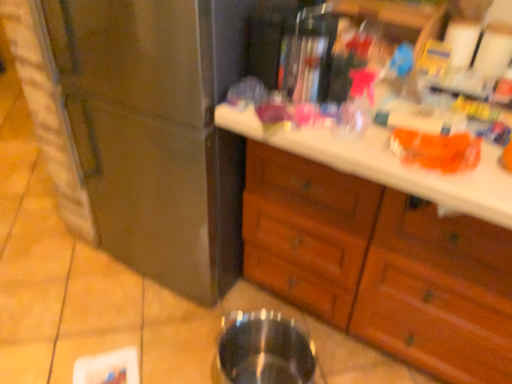
Question: Does transparent glass at lower center have a greater height compared to wooden drawers at center?

Choices:
 (A) no
 (B) yes

Answer: (A)

Question: Is transparent glass at lower center positioned before wooden drawers at center?

Choices:
 (A) yes
 (B) no

Answer: (B)

Question: Considering the relative positions of transparent glass at lower center and wooden drawers at center in the image provided, is transparent glass at lower center to the left of wooden drawers at center from the viewer's perspective?

Choices:
 (A) no
 (B) yes

Answer: (B)

Question: Is transparent glass at lower center oriented away from wooden drawers at center?

Choices:
 (A) no
 (B) yes

Answer: (B)

Question: Is transparent glass at lower center aimed at wooden drawers at center?

Choices:
 (A) yes
 (B) no

Answer: (B)

Question: From the image's perspective, is transparent glass at lower center below wooden drawers at center?

Choices:
 (A) yes
 (B) no

Answer: (A)

Question: Considering the relative positions of stainless steel refrigerator at left and wooden drawers at center in the image provided, is stainless steel refrigerator at left to the left of wooden drawers at center from the viewer's perspective?

Choices:
 (A) no
 (B) yes

Answer: (B)

Question: Can you confirm if stainless steel refrigerator at left is positioned to the right of wooden drawers at center?

Choices:
 (A) yes
 (B) no

Answer: (B)

Question: Is stainless steel refrigerator at left further to camera compared to wooden drawers at center?

Choices:
 (A) no
 (B) yes

Answer: (B)

Question: Considering the relative sizes of stainless steel refrigerator at left and wooden drawers at center in the image provided, is stainless steel refrigerator at left smaller than wooden drawers at center?

Choices:
 (A) no
 (B) yes

Answer: (B)

Question: Could you tell me if stainless steel refrigerator at left is turned towards wooden drawers at center?

Choices:
 (A) no
 (B) yes

Answer: (A)

Question: Is stainless steel refrigerator at left positioned far away from wooden drawers at center?

Choices:
 (A) yes
 (B) no

Answer: (B)

Question: Is transparent glass at lower center located outside stainless steel refrigerator at left?

Choices:
 (A) no
 (B) yes

Answer: (B)